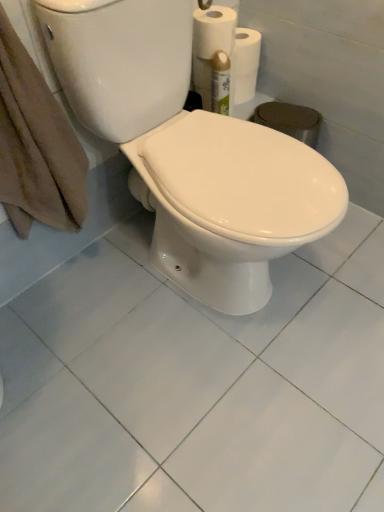
Measure the distance between point (19, 52) and camera.

Point (19, 52) is 82.40 centimeters away from camera.

You are a GUI agent. You are given a task and a screenshot of the screen. Output one action in this format:
    pyautogui.click(x=<x>, y=<y>)
    Task: Click on the brown cotton towel at left
    
    Given the screenshot: What is the action you would take?
    pyautogui.click(x=36, y=146)

Does white glossy ceramic tile at center have a smaller size compared to white glossy toilet at center?

Yes.

Is white glossy ceramic tile at center looking in the opposite direction of white glossy toilet at center?

No.

Which of these two, white glossy ceramic tile at center or white glossy toilet at center, stands taller?

Standing taller between the two is white glossy toilet at center.

Where is `ceramic tile located below the white glossy toilet at center (from the image's perspective)`? This screenshot has width=384, height=512. ceramic tile located below the white glossy toilet at center (from the image's perspective) is located at coordinates (197, 384).

Find the location of a particular element. ceramic tile below the white glossy toilet at center (from the image's perspective) is located at coordinates coord(197,384).

From a real-world perspective, does white glossy toilet at center stand above white glossy ceramic tile at center?

Yes, from a real-world perspective, white glossy toilet at center is over white glossy ceramic tile at center

Which of these two, white glossy toilet at center or white glossy ceramic tile at center, is smaller?

Answer: Smaller between the two is white glossy ceramic tile at center.

Based on the photo, which is closer to the camera, (307, 173) or (12, 74)?

The point (12, 74) is closer.

From the image's perspective, which object appears higher, white glossy toilet at center or brown cotton towel at left?

From the image's view, brown cotton towel at left is above.

Where is `ceramic tile below the brown cotton towel at left (from the image's perspective)`? ceramic tile below the brown cotton towel at left (from the image's perspective) is located at coordinates (197, 384).

Can you confirm if white glossy ceramic tile at center is shorter than brown cotton towel at left?

Yes.

Is white glossy ceramic tile at center surrounding brown cotton towel at left?

No.

What's the angular difference between white glossy ceramic tile at center and brown cotton towel at left's facing directions?

The facing directions of white glossy ceramic tile at center and brown cotton towel at left are 0.815 degrees apart.

How distant is brown cotton towel at left from white glossy ceramic tile at center?

They are 19.66 inches apart.

Is brown cotton towel at left oriented away from white glossy ceramic tile at center?

brown cotton towel at left does not have its back to white glossy ceramic tile at center.

Which object is thinner, brown cotton towel at left or white glossy ceramic tile at center?

brown cotton towel at left.

Considering the relative sizes of brown cotton towel at left and white glossy ceramic tile at center in the image provided, is brown cotton towel at left bigger than white glossy ceramic tile at center?

No, brown cotton towel at left is not bigger than white glossy ceramic tile at center.

Is white glossy toilet at center at the back of brown cotton towel at left?

No, brown cotton towel at left's orientation is not away from white glossy toilet at center.

Looking at this image, does brown cotton towel at left come behind white glossy toilet at center?

Yes, brown cotton towel at left is further from the camera.

How distant is brown cotton towel at left from white glossy toilet at center?

The distance of brown cotton towel at left from white glossy toilet at center is 9.80 inches.

From the image's perspective, who appears lower, brown cotton towel at left or white glossy toilet at center?

white glossy toilet at center appears lower in the image.

Locate an element on the screen. The height and width of the screenshot is (512, 384). ceramic tile behind the white glossy toilet at center is located at coordinates (197, 384).

Where is `toilet located in front of the white glossy ceramic tile at center`? toilet located in front of the white glossy ceramic tile at center is located at coordinates (189, 151).

When comparing their distances from white glossy toilet at center, does brown cotton towel at left or white glossy ceramic tile at center seem further?

The object further to white glossy toilet at center is white glossy ceramic tile at center.

Based on their spatial positions, is white glossy toilet at center or white glossy ceramic tile at center closer to brown cotton towel at left?

white glossy toilet at center is closer to brown cotton towel at left.

When comparing their distances from brown cotton towel at left, does white glossy ceramic tile at center or white glossy toilet at center seem further?

white glossy ceramic tile at center is further to brown cotton towel at left.

Considering their positions, is brown cotton towel at left positioned further to white glossy ceramic tile at center than white glossy toilet at center?

brown cotton towel at left is positioned further to the anchor white glossy ceramic tile at center.

Considering their positions, is white glossy toilet at center positioned further to white glossy ceramic tile at center than brown cotton towel at left?

The object further to white glossy ceramic tile at center is brown cotton towel at left.

Which object lies nearer to the anchor point white glossy toilet at center, white glossy ceramic tile at center or brown cotton towel at left?

The object closer to white glossy toilet at center is brown cotton towel at left.

Find the location of a particular element. toilet situated between brown cotton towel at left and white glossy ceramic tile at center from left to right is located at coordinates (189, 151).